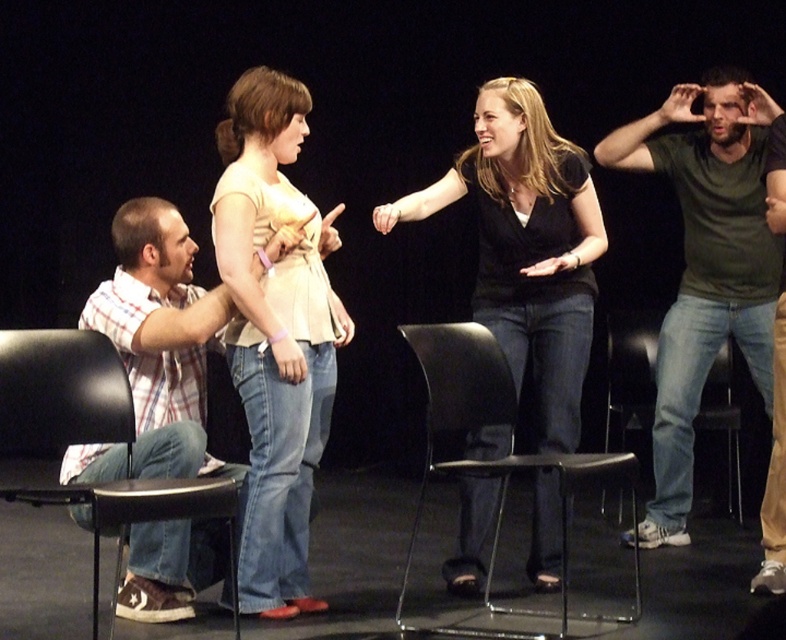
Question: Is denim jeans at center to the left of denim fabric chair at right from the viewer's perspective?

Choices:
 (A) yes
 (B) no

Answer: (A)

Question: Among these points, which one is farthest from the camera?

Choices:
 (A) (325, 301)
 (B) (472, 504)
 (C) (133, 472)
 (D) (698, 403)

Answer: (D)

Question: Is black matte shirt at center below black plastic chair at center?

Choices:
 (A) yes
 (B) no

Answer: (B)

Question: Which object is the closest to the black matte shirt at center?

Choices:
 (A) plaid cotton shirt at left
 (B) denim fabric chair at right

Answer: (A)

Question: Is plaid cotton shirt at left smaller than black plastic chair at lower left?

Choices:
 (A) no
 (B) yes

Answer: (A)

Question: Which point is farther to the camera?

Choices:
 (A) (472, 516)
 (B) (13, 369)

Answer: (A)